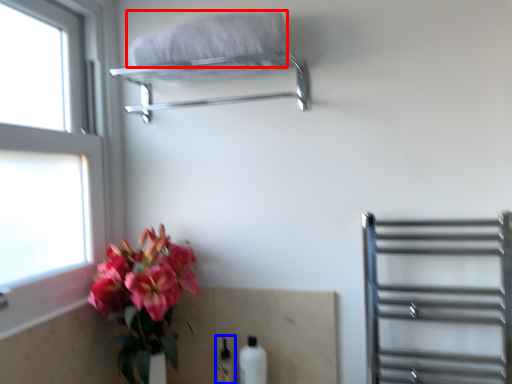
Question: Which object is further to the camera taking this photo, bath towel (highlighted by a red box) or bottle (highlighted by a blue box)?

Choices:
 (A) bath towel
 (B) bottle

Answer: (B)